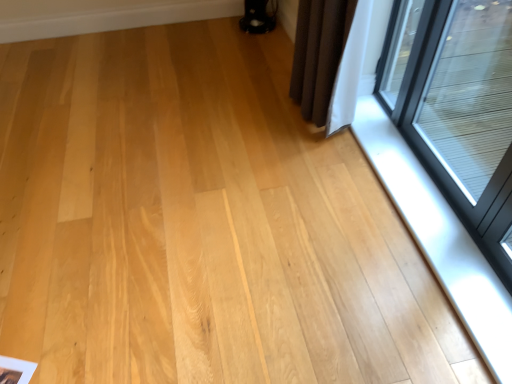
Question: Considering the relative positions of transparent glass window at upper right and satin silver window sill at lower right in the image provided, is transparent glass window at upper right to the left or to the right of satin silver window sill at lower right?

Choices:
 (A) left
 (B) right

Answer: (B)

Question: Is transparent glass window at upper right situated inside satin silver window sill at lower right or outside?

Choices:
 (A) outside
 (B) inside

Answer: (A)

Question: From a real-world perspective, is transparent glass window at upper right physically located above or below satin silver window sill at lower right?

Choices:
 (A) above
 (B) below

Answer: (A)

Question: Is point (438, 216) closer or farther from the camera than point (493, 97)?

Choices:
 (A) closer
 (B) farther

Answer: (A)

Question: Is satin silver window sill at lower right spatially inside transparent glass window at upper right, or outside of it?

Choices:
 (A) outside
 (B) inside

Answer: (A)

Question: From the image's perspective, is satin silver window sill at lower right located above or below transparent glass window at upper right?

Choices:
 (A) below
 (B) above

Answer: (A)

Question: In terms of width, does satin silver window sill at lower right look wider or thinner when compared to transparent glass window at upper right?

Choices:
 (A) thin
 (B) wide

Answer: (B)